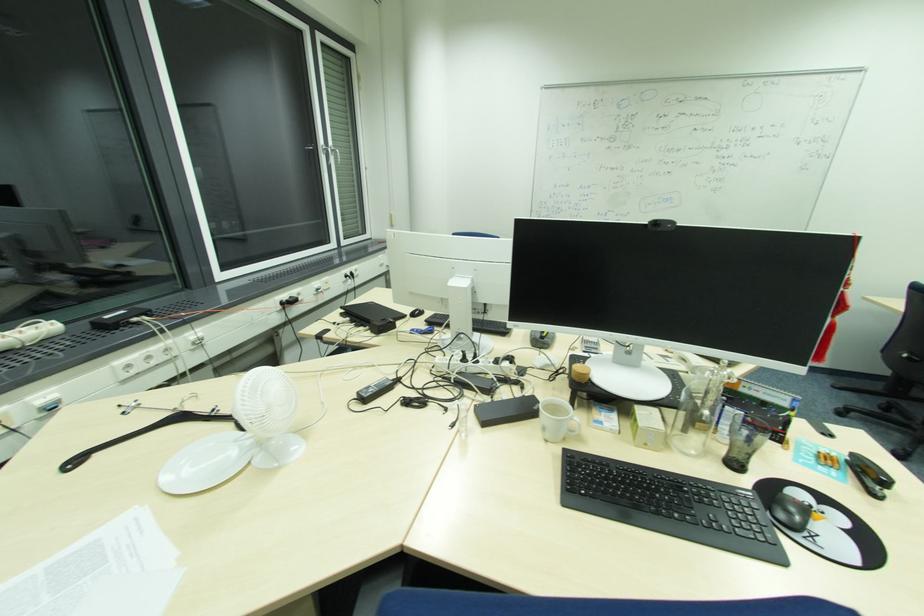
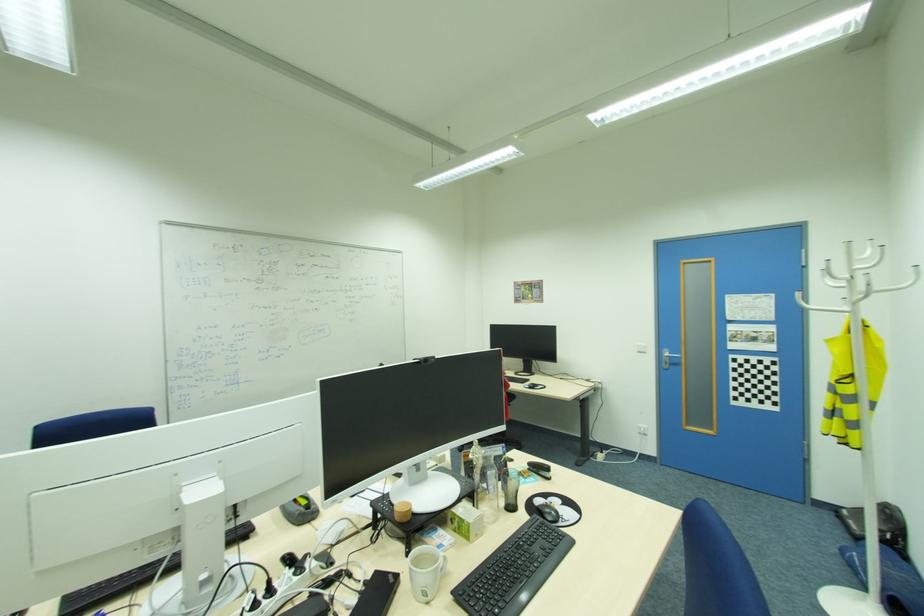
Question: The images are taken continuously from a first-person perspective. In which direction is your viewpoint rotating?

Choices:
 (A) Left
 (B) Right
 (C) Up
 (D) Down

Answer: (B)